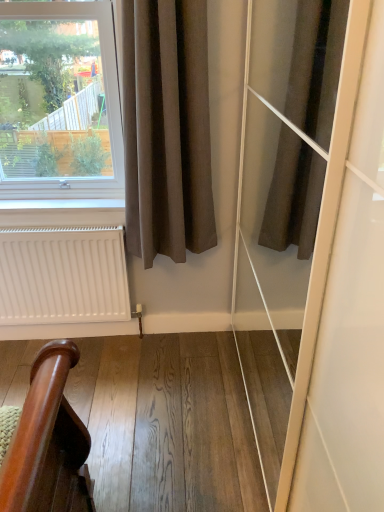
Question: Based on their sizes in the image, would you say white matte radiator at lower left is bigger or smaller than wooden handrail at lower left?

Choices:
 (A) small
 (B) big

Answer: (A)

Question: From their relative heights in the image, would you say white matte radiator at lower left is taller or shorter than wooden handrail at lower left?

Choices:
 (A) tall
 (B) short

Answer: (A)

Question: Which object is positioned closest to the white matte radiator at lower left?

Choices:
 (A) brown cotton curtain at left
 (B) wooden handrail at lower left

Answer: (B)

Question: Which object is the farthest from the white matte radiator at lower left?

Choices:
 (A) brown cotton curtain at left
 (B) wooden handrail at lower left

Answer: (A)